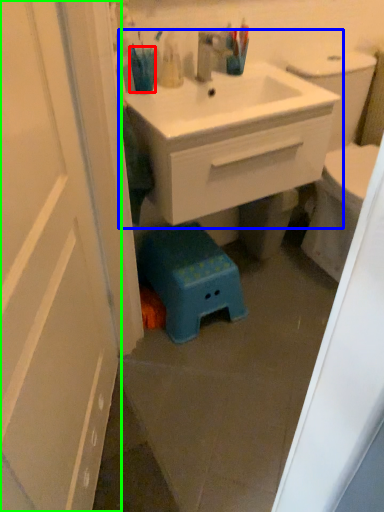
Question: Which is farther away from teal (highlighted by a red box)? bathroom cabinet (highlighted by a blue box) or door (highlighted by a green box)?

Choices:
 (A) bathroom cabinet
 (B) door

Answer: (B)